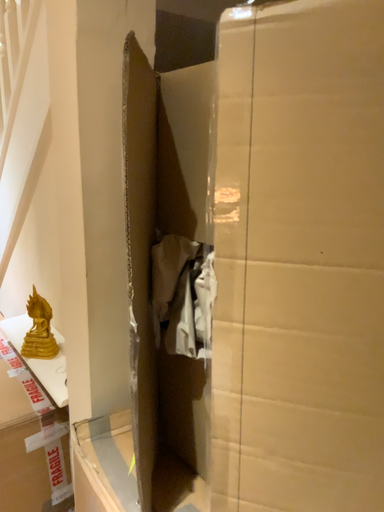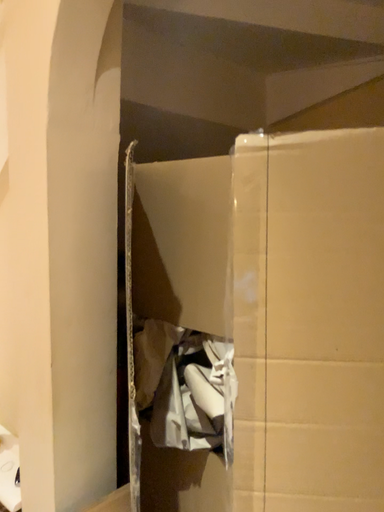
Question: How did the camera likely rotate when shooting the video?

Choices:
 (A) rotated left
 (B) rotated right

Answer: (B)